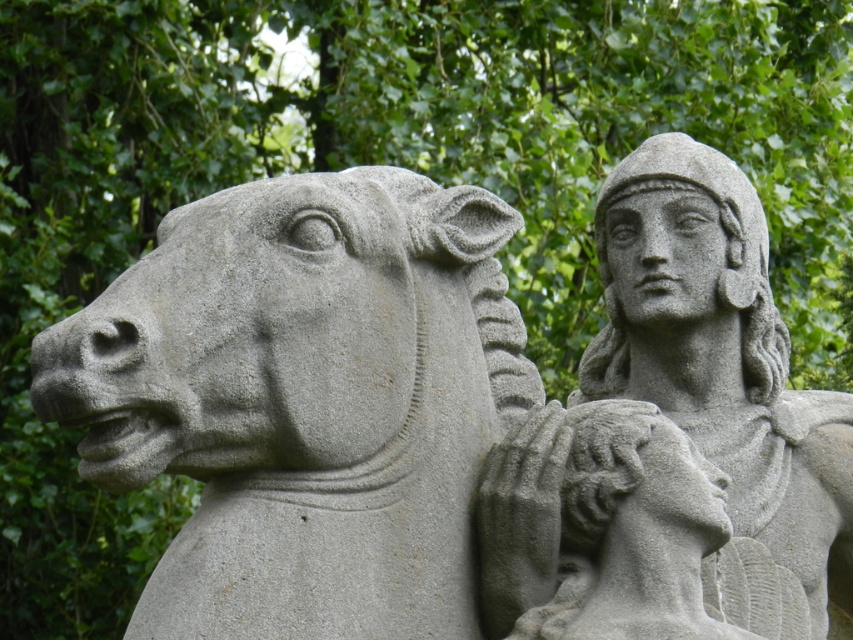
Question: Among these points, which one is nearest to the camera?

Choices:
 (A) (506, 500)
 (B) (283, 339)
 (C) (654, 248)

Answer: (B)

Question: Can you confirm if gray stone horse at left is thinner than gray stone warrior at upper right?

Choices:
 (A) yes
 (B) no

Answer: (A)

Question: Considering the relative positions of gray stone warrior at upper right and gray stone head at center in the image provided, where is gray stone warrior at upper right located with respect to gray stone head at center?

Choices:
 (A) left
 (B) right

Answer: (B)

Question: Where is gray stone horse at left located in relation to gray stone head at center in the image?

Choices:
 (A) right
 (B) left

Answer: (B)

Question: Based on their relative distances, which object is nearer to the gray stone horse at left?

Choices:
 (A) gray stone warrior at upper right
 (B) gray stone head at center

Answer: (B)

Question: Among these objects, which one is farthest from the camera?

Choices:
 (A) gray stone horse at left
 (B) gray stone head at center

Answer: (B)